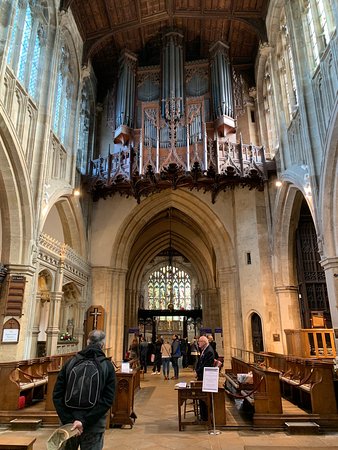
I want to click on end of pew, so tap(263, 387), tap(325, 393), tap(8, 389).